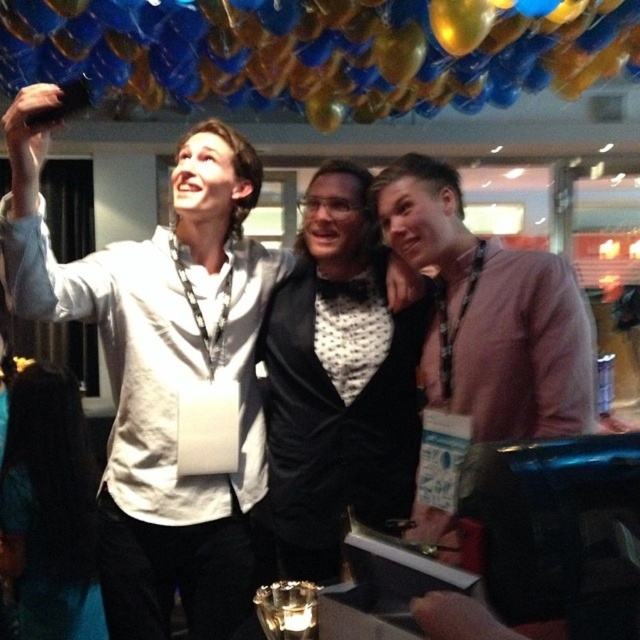
You are a photographer adjusting your camera settings. You notice the black satin bow tie at center and the pink fabric shirt at right in your viewfinder. Which object should you focus on first to ensure it appears sharp in the photo?

You should focus on the black satin bow tie at center first because it is closer to the viewer than the pink fabric shirt at right, so it requires prioritized focus to appear sharp.

You are trying to take a selfie with your friends in this scene. You notice the white matte shirt at upper left and the blue glossy balloon at upper center. Which object is closer to the camera?

The white matte shirt at upper left is closer to the camera because it is in front of the blue glossy balloon at upper center.